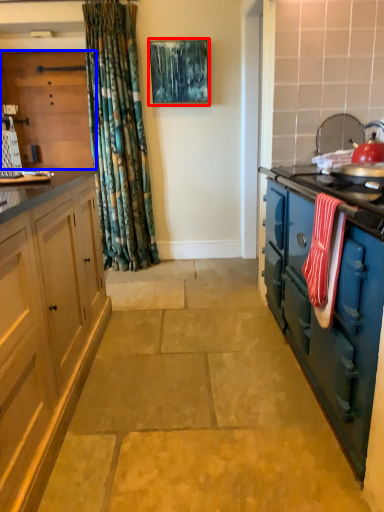
Question: Which of the following is the closest to the observer, picture frame (highlighted by a red box) or cabinetry (highlighted by a blue box)?

Choices:
 (A) picture frame
 (B) cabinetry

Answer: (A)